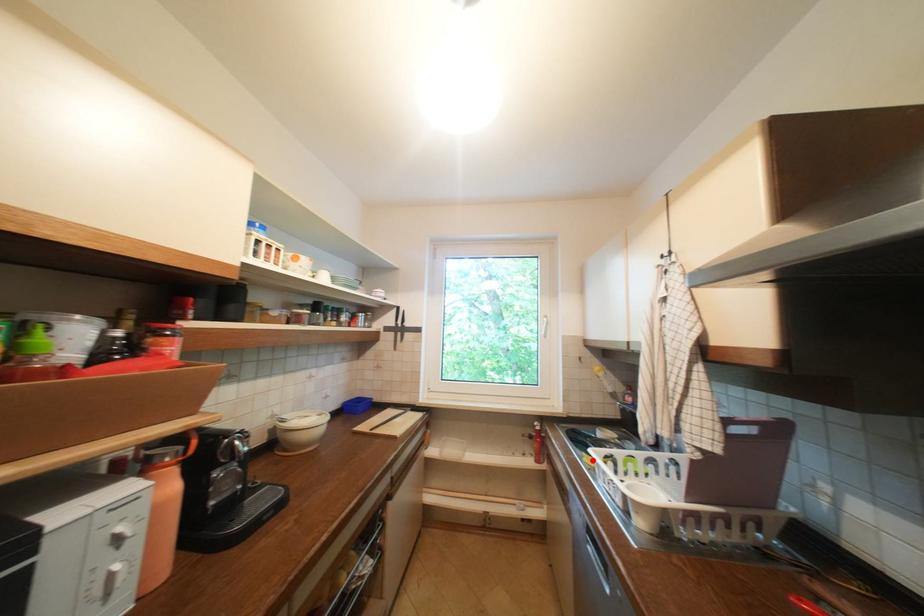
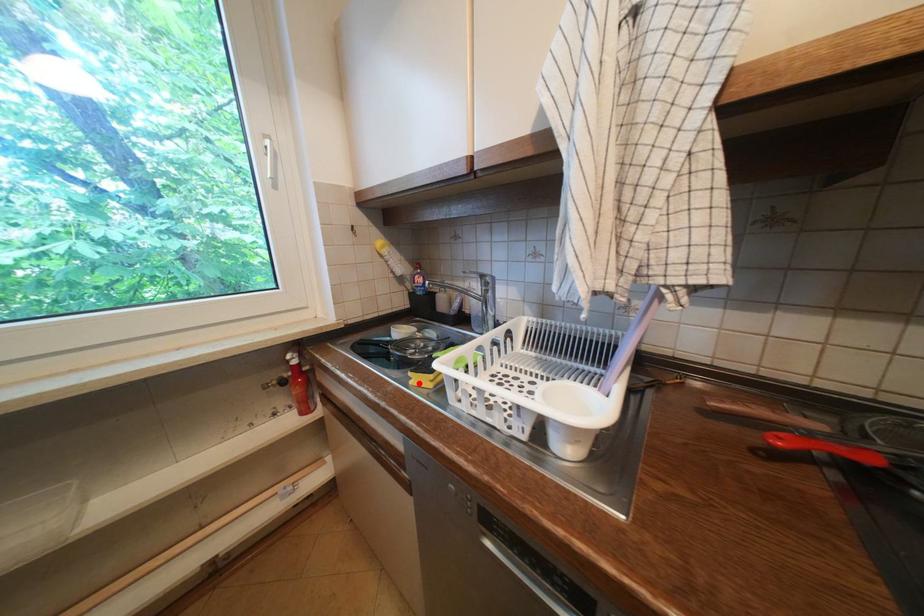
I am providing you with two images of the same scene from different viewpoints. A red point is marked on the first image and another point is marked on the second image. Does the point marked in image1 correspond to the same location as the one in image2?

Yes